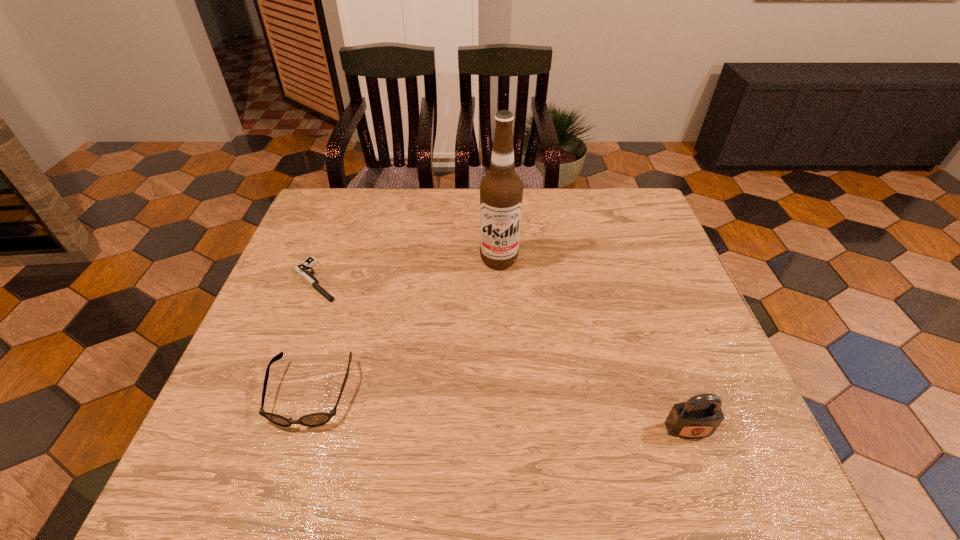
Identify the location of empty location between the sunglasses and the alcohol. (404, 327).

At what (x,y) coordinates should I click in order to perform the action: click on unoccupied area between the shortest object and the third tallest object. Please return your answer as a coordinate pair (x, y). Looking at the image, I should click on (313, 337).

Where is `free spot between the shortest object and the second object from right to left`? Image resolution: width=960 pixels, height=540 pixels. free spot between the shortest object and the second object from right to left is located at coordinates (407, 269).

This screenshot has width=960, height=540. In order to click on free space between the third tallest object and the second tallest object in this screenshot , I will do `click(499, 411)`.

Find the location of a particular element. The height and width of the screenshot is (540, 960). empty space that is in between the padlock and the pistol is located at coordinates (502, 355).

Where is `object that stands as the third closest to the alcohol`? The width and height of the screenshot is (960, 540). object that stands as the third closest to the alcohol is located at coordinates (700, 416).

Where is `object that is the second closest to the rightmost object`? object that is the second closest to the rightmost object is located at coordinates (314, 419).